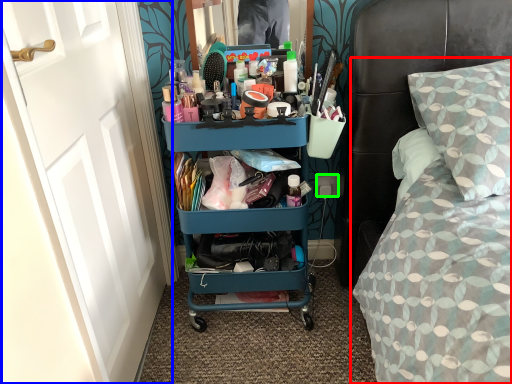
Question: Which object is positioned farthest from bed (highlighted by a red box)? Select from door (highlighted by a blue box) and power outlet (highlighted by a green box).

Choices:
 (A) door
 (B) power outlet

Answer: (A)